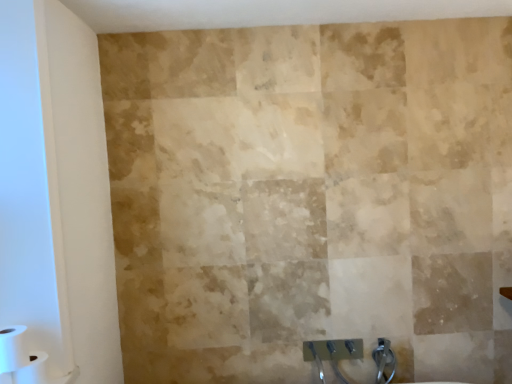
Question: Would you consider transparent glass door at left to be distant from white matte toilet paper at lower left, the 2th toilet paper from the top?

Choices:
 (A) yes
 (B) no

Answer: (B)

Question: Is transparent glass door at left oriented away from white matte toilet paper at lower left, the 2th toilet paper from the top?

Choices:
 (A) no
 (B) yes

Answer: (B)

Question: Is transparent glass door at left at the right side of white matte toilet paper at lower left, the 2th toilet paper from the top?

Choices:
 (A) yes
 (B) no

Answer: (A)

Question: Is transparent glass door at left wider than white matte toilet paper at lower left, arranged as the 1th toilet paper when ordered from the bottom?

Choices:
 (A) yes
 (B) no

Answer: (B)

Question: From a real-world perspective, is transparent glass door at left physically below white matte toilet paper at lower left, the 2th toilet paper from the top?

Choices:
 (A) no
 (B) yes

Answer: (A)

Question: Is transparent glass door at left smaller than white matte toilet paper at lower left, arranged as the 1th toilet paper when ordered from the bottom?

Choices:
 (A) no
 (B) yes

Answer: (A)

Question: From a real-world perspective, is white matte toilet paper at lower left, which is the 1th toilet paper in top-to-bottom order, below white matte toilet paper at lower left, arranged as the 1th toilet paper when ordered from the bottom?

Choices:
 (A) yes
 (B) no

Answer: (B)

Question: Can you see white matte toilet paper at lower left, which appears as the 2th toilet paper when ordered from the bottom, touching white matte toilet paper at lower left, arranged as the 1th toilet paper when ordered from the bottom?

Choices:
 (A) no
 (B) yes

Answer: (B)

Question: Can you confirm if white matte toilet paper at lower left, which appears as the 2th toilet paper when ordered from the bottom, is wider than white matte toilet paper at lower left, arranged as the 1th toilet paper when ordered from the bottom?

Choices:
 (A) yes
 (B) no

Answer: (B)

Question: Does white matte toilet paper at lower left, which is the 1th toilet paper in top-to-bottom order, have a lesser height compared to white matte toilet paper at lower left, the 2th toilet paper from the top?

Choices:
 (A) no
 (B) yes

Answer: (B)

Question: Is white matte toilet paper at lower left, the 2th toilet paper from the top, inside white matte toilet paper at lower left, which is the 1th toilet paper in top-to-bottom order?

Choices:
 (A) no
 (B) yes

Answer: (A)

Question: Is white matte toilet paper at lower left, which is the 1th toilet paper in top-to-bottom order, facing away from white matte toilet paper at lower left, arranged as the 1th toilet paper when ordered from the bottom?

Choices:
 (A) no
 (B) yes

Answer: (A)

Question: Could you tell me if white matte toilet paper at lower left, which is the 1th toilet paper in top-to-bottom order, is turned towards transparent glass door at left?

Choices:
 (A) yes
 (B) no

Answer: (A)